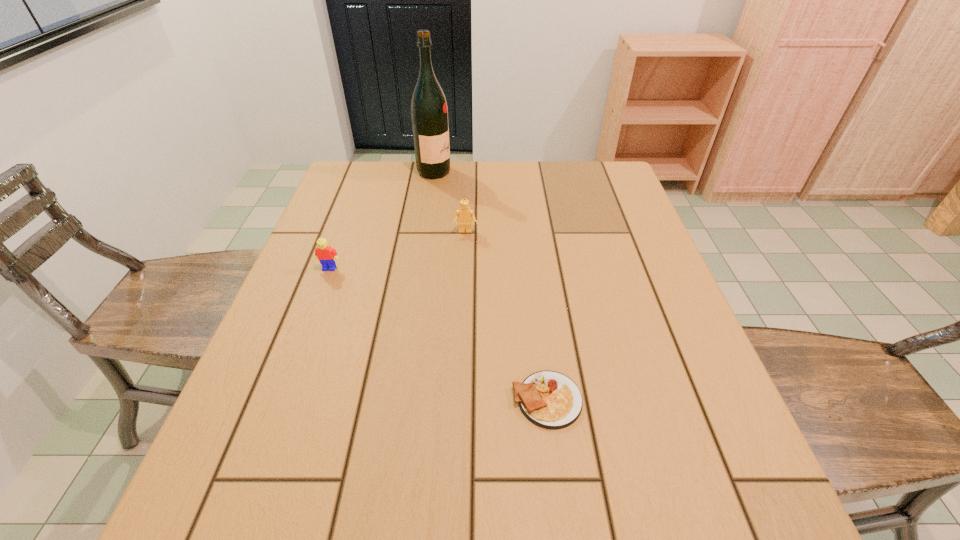
I want to click on object that is the second closest one to the third object from left to right, so click(x=326, y=255).

At what (x,y) coordinates should I click in order to perform the action: click on free location that satisfies the following two spatial constraints: 1. on the front-facing side of the shortest object; 2. on the left side of the left Lego. Please return your answer as a coordinate pair (x, y). Image resolution: width=960 pixels, height=540 pixels. Looking at the image, I should click on (280, 400).

I want to click on free space that satisfies the following two spatial constraints: 1. on the front-facing side of the tallest object; 2. on the front-facing side of the third farthest object, so click(x=420, y=268).

Locate an element on the screen. vacant space that satisfies the following two spatial constraints: 1. on the front-facing side of the shortest object; 2. on the left side of the second object from left to right is located at coordinates (400, 400).

Identify the location of free spot that satisfies the following two spatial constraints: 1. on the front-facing side of the liquor; 2. on the front-facing side of the nearer Lego. This screenshot has width=960, height=540. (420, 268).

At what (x,y) coordinates should I click in order to perform the action: click on free space that satisfies the following two spatial constraints: 1. on the front-facing side of the left Lego; 2. on the left side of the rightmost object. Please return your answer as a coordinate pair (x, y). This screenshot has width=960, height=540. Looking at the image, I should click on (280, 400).

Where is `free region that satisfies the following two spatial constraints: 1. on the face of the third object from left to right; 2. on the right side of the nearest object`? The height and width of the screenshot is (540, 960). free region that satisfies the following two spatial constraints: 1. on the face of the third object from left to right; 2. on the right side of the nearest object is located at coordinates (459, 400).